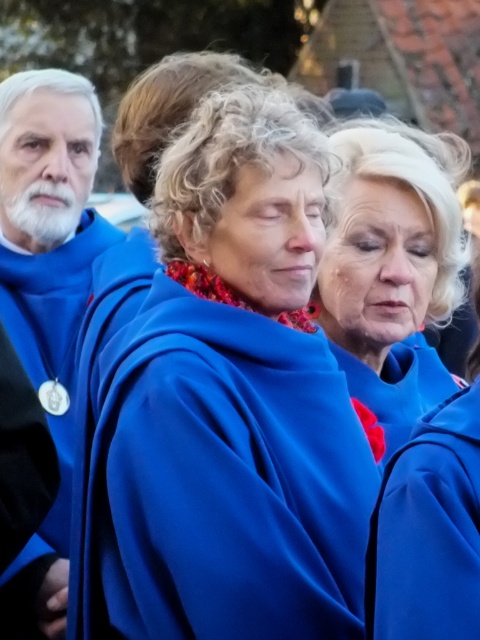
Question: Can you confirm if blue matte coat at center is positioned below blue woolen coat at center?

Choices:
 (A) yes
 (B) no

Answer: (A)

Question: Which of the following is the closest to the observer?

Choices:
 (A) (459, 211)
 (B) (188, 356)

Answer: (B)

Question: Among these objects, which one is nearest to the camera?

Choices:
 (A) blue matte coat at center
 (B) blue woolen coat at center
 (C) blue smooth robe at center

Answer: (C)

Question: Among these points, which one is nearest to the camera?

Choices:
 (A) (416, 358)
 (B) (420, 611)

Answer: (B)

Question: Is blue matte coat at center to the left of blue woolen coat at center from the viewer's perspective?

Choices:
 (A) no
 (B) yes

Answer: (B)

Question: Does blue woolen coat at center appear under blue smooth robe at center?

Choices:
 (A) no
 (B) yes

Answer: (A)